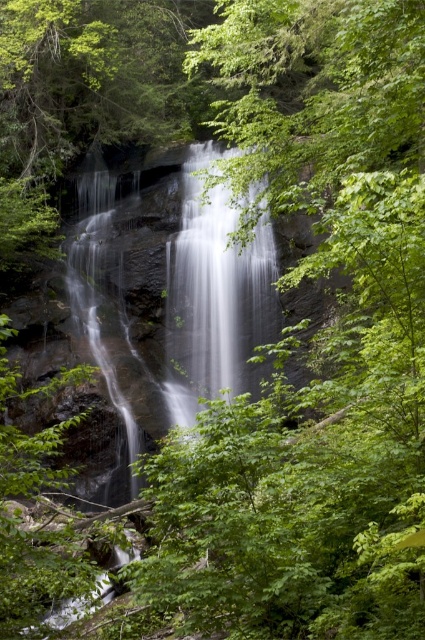
Question: Among these objects, which one is nearest to the camera?

Choices:
 (A) smooth gray rock waterfall at center
 (B) white smooth waterfall at center

Answer: (A)

Question: Which point is closer to the camera?

Choices:
 (A) (104, 342)
 (B) (221, 326)

Answer: (A)

Question: Can you confirm if smooth gray rock waterfall at center is smaller than white smooth waterfall at center?

Choices:
 (A) no
 (B) yes

Answer: (A)

Question: From the image, what is the correct spatial relationship of smooth gray rock waterfall at center in relation to white smooth waterfall at center?

Choices:
 (A) right
 (B) left

Answer: (B)

Question: Can you confirm if smooth gray rock waterfall at center is thinner than white smooth waterfall at center?

Choices:
 (A) no
 (B) yes

Answer: (A)